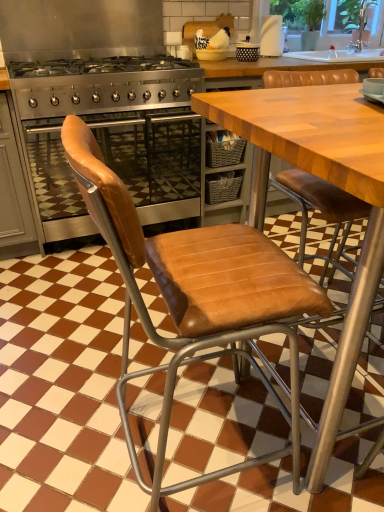
Question: From a real-world perspective, is transparent glass window screen at upper right on top of brown leather chair at left?

Choices:
 (A) no
 (B) yes

Answer: (B)

Question: Would you say transparent glass window screen at upper right is a long distance from brown leather chair at left?

Choices:
 (A) yes
 (B) no

Answer: (A)

Question: Considering the relative sizes of transparent glass window screen at upper right and brown leather chair at left in the image provided, is transparent glass window screen at upper right smaller than brown leather chair at left?

Choices:
 (A) yes
 (B) no

Answer: (A)

Question: Is the depth of transparent glass window screen at upper right less than that of brown leather chair at left?

Choices:
 (A) yes
 (B) no

Answer: (B)

Question: Does transparent glass window screen at upper right have a lesser height compared to brown leather chair at left?

Choices:
 (A) yes
 (B) no

Answer: (A)

Question: Is brown leather chair at left located within transparent glass window screen at upper right?

Choices:
 (A) yes
 (B) no

Answer: (B)

Question: Considering the relative positions of stainless steel gas stove at center and satin silver oven at left in the image provided, is stainless steel gas stove at center to the right of satin silver oven at left from the viewer's perspective?

Choices:
 (A) no
 (B) yes

Answer: (B)

Question: Can you confirm if stainless steel gas stove at center is taller than satin silver oven at left?

Choices:
 (A) no
 (B) yes

Answer: (A)

Question: Is stainless steel gas stove at center not within satin silver oven at left?

Choices:
 (A) yes
 (B) no

Answer: (A)

Question: From a real-world perspective, is stainless steel gas stove at center physically below satin silver oven at left?

Choices:
 (A) no
 (B) yes

Answer: (A)

Question: Is stainless steel gas stove at center to the left of satin silver oven at left from the viewer's perspective?

Choices:
 (A) yes
 (B) no

Answer: (B)

Question: Are stainless steel gas stove at center and satin silver oven at left located far from each other?

Choices:
 (A) no
 (B) yes

Answer: (A)

Question: Does stainless steel gas stove at center contain white matte paper towel at upper right?

Choices:
 (A) no
 (B) yes

Answer: (A)